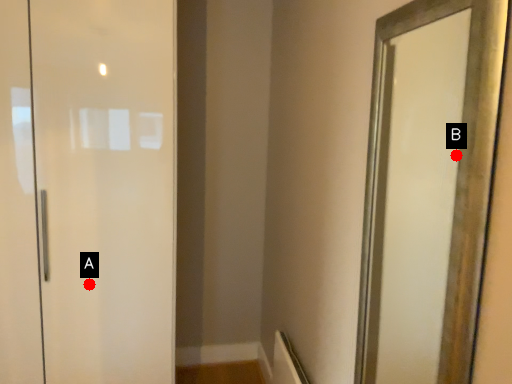
Question: Two points are circled on the image, labeled by A and B beside each circle. Among these points, which one is nearest to the camera?

Choices:
 (A) A is closer
 (B) B is closer

Answer: (A)